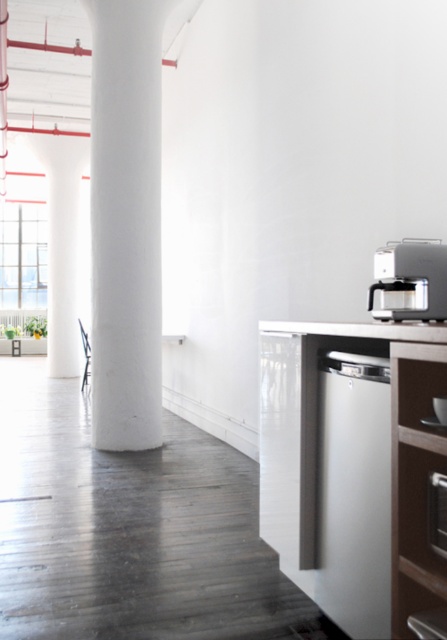
Question: Does white glossy dishwasher at lower right have a larger size compared to satin white dishwasher at lower right?

Choices:
 (A) yes
 (B) no

Answer: (A)

Question: Can you confirm if white glossy dishwasher at lower right is positioned to the right of satin white dishwasher at lower right?

Choices:
 (A) no
 (B) yes

Answer: (B)

Question: Which point is farther to the camera?

Choices:
 (A) white glossy dishwasher at lower right
 (B) white glossy pillar at center

Answer: (B)

Question: Among these objects, which one is farthest from the camera?

Choices:
 (A) white glossy dishwasher at lower right
 (B) satin silver coffee machine at upper right
 (C) white smooth column at center

Answer: (C)

Question: Is satin silver coffee machine at upper right to the left of white glossy oven at lower right from the viewer's perspective?

Choices:
 (A) yes
 (B) no

Answer: (B)

Question: Which of the following is the closest to the observer?

Choices:
 (A) (442, 484)
 (B) (295, 465)
 (C) (414, 269)
 (D) (81, 324)

Answer: (A)